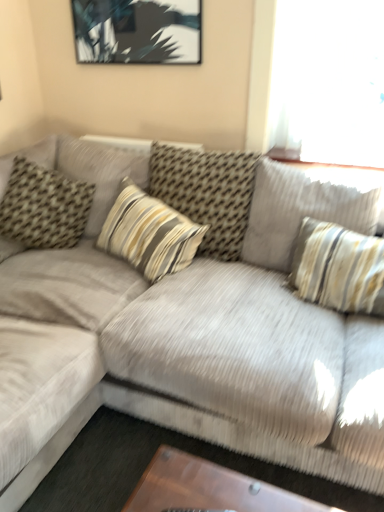
Locate an element on the screen. striped fabric pillow at center, which ranks as the second pillow in left-to-right order is located at coordinates (149, 233).

Image resolution: width=384 pixels, height=512 pixels. In order to click on velvet beige couch at center in this screenshot , I will do `click(188, 337)`.

The image size is (384, 512). In order to click on striped fabric pillow at center, acting as the 3th pillow starting from the right in this screenshot , I will do `click(149, 233)`.

Is there a large distance between striped fabric pillow at center, which ranks as the second pillow in left-to-right order, and velvet beige couch at center?

Actually, striped fabric pillow at center, which ranks as the second pillow in left-to-right order, and velvet beige couch at center are a little close together.

From the image's perspective, is striped fabric pillow at center, acting as the 3th pillow starting from the right, above or below velvet beige couch at center?

Clearly, from the image's perspective, striped fabric pillow at center, acting as the 3th pillow starting from the right, is above velvet beige couch at center.

Looking at the image, does striped fabric pillow at center, which ranks as the second pillow in left-to-right order, seem bigger or smaller compared to velvet beige couch at center?

In the image, striped fabric pillow at center, which ranks as the second pillow in left-to-right order, appears to be smaller than velvet beige couch at center.

Which point is more distant from viewer, (x=105, y=234) or (x=254, y=283)?

The point (x=105, y=234) is behind.

Which of these two, striped fabric pillow at upper right, the first pillow in the right-to-left sequence, or striped fabric pillow at center, which ranks as the second pillow in left-to-right order, is thinner?

striped fabric pillow at upper right, the first pillow in the right-to-left sequence, is thinner.

Which of these two, striped fabric pillow at upper right, the fourth pillow from the left, or striped fabric pillow at center, which ranks as the second pillow in left-to-right order, is bigger?

With larger size is striped fabric pillow at upper right, the fourth pillow from the left.

Can you see striped fabric pillow at upper right, the fourth pillow from the left, touching striped fabric pillow at center, acting as the 3th pillow starting from the right?

No, striped fabric pillow at upper right, the fourth pillow from the left, is not next to striped fabric pillow at center, acting as the 3th pillow starting from the right.

From the image's perspective, between velvet beige couch at center and striped fabric pillow at center, acting as the 3th pillow starting from the right, who is located below?

velvet beige couch at center is shown below in the image.

How many degrees apart are the facing directions of velvet beige couch at center and striped fabric pillow at center, which ranks as the second pillow in left-to-right order?

The angular difference between velvet beige couch at center and striped fabric pillow at center, which ranks as the second pillow in left-to-right order, is 16 degrees.

Can we say velvet beige couch at center lies outside striped fabric pillow at center, acting as the 3th pillow starting from the right?

Yes, velvet beige couch at center is located beyond the bounds of striped fabric pillow at center, acting as the 3th pillow starting from the right.

Would you say velvet beige couch at center is a long distance from striped fabric pillow at center, which ranks as the second pillow in left-to-right order?

velvet beige couch at center is near striped fabric pillow at center, which ranks as the second pillow in left-to-right order, not far away.

Which object is positioned more to the left, striped fabric pillow at center, the second pillow in the right-to-left sequence, or brown textured pillow at left, positioned as the fourth pillow in right-to-left order?

Positioned to the left is brown textured pillow at left, positioned as the fourth pillow in right-to-left order.

From the image's perspective, is striped fabric pillow at center, which is the third pillow in left-to-right order, under brown textured pillow at left, positioned as the fourth pillow in right-to-left order?

No.

From a real-world perspective, count 2nd pillows downward from the striped fabric pillow at center, which is the third pillow in left-to-right order, and point to it. Please provide its 2D coordinates.

[(44, 207)]

Does striped fabric pillow at center, the second pillow in the right-to-left sequence, turn towards brown textured pillow at left, positioned as the fourth pillow in right-to-left order?

No, striped fabric pillow at center, the second pillow in the right-to-left sequence, does not turn towards brown textured pillow at left, positioned as the fourth pillow in right-to-left order.

I want to click on pillow that is the 2nd object above the velvet beige couch at center (from a real-world perspective), so click(x=44, y=207).

Between point (76, 232) and point (53, 422), which one is positioned in front?

The point (53, 422) is closer.

From the image's perspective, which one is positioned higher, brown textured pillow at left, positioned as the fourth pillow in right-to-left order, or velvet beige couch at center?

From the image's view, brown textured pillow at left, positioned as the fourth pillow in right-to-left order, is above.

Between brown textured pillow at left, the 1th pillow from the left, and striped fabric pillow at upper right, the fourth pillow from the left, which one has smaller width?

Thinner between the two is brown textured pillow at left, the 1th pillow from the left.

You are a GUI agent. You are given a task and a screenshot of the screen. Output one action in this format:
    pyautogui.click(x=<x>, y=<y>)
    Task: Click on the 1st pillow located beneath the striped fabric pillow at upper right, the first pillow in the right-to-left sequence (from a real-world perspective)
    
    Given the screenshot: What is the action you would take?
    pyautogui.click(x=44, y=207)

Looking at this image, from a real-world perspective, is brown textured pillow at left, positioned as the fourth pillow in right-to-left order, under striped fabric pillow at upper right, the first pillow in the right-to-left sequence?

Yes, from a real-world perspective, brown textured pillow at left, positioned as the fourth pillow in right-to-left order, is beneath striped fabric pillow at upper right, the first pillow in the right-to-left sequence.

From the image's perspective, between brown textured pillow at left, positioned as the fourth pillow in right-to-left order, and striped fabric pillow at upper right, the first pillow in the right-to-left sequence, who is located below?

striped fabric pillow at upper right, the first pillow in the right-to-left sequence, is shown below in the image.

Who is taller, velvet beige couch at center or striped fabric pillow at upper right, the first pillow in the right-to-left sequence?

velvet beige couch at center is taller.

Considering the positions of point (304, 464) and point (244, 236), is point (304, 464) closer or farther from the camera than point (244, 236)?

Point (304, 464).

Is velvet beige couch at center to the right of striped fabric pillow at upper right, the fourth pillow from the left, from the viewer's perspective?

No, velvet beige couch at center is not to the right of striped fabric pillow at upper right, the fourth pillow from the left.

In terms of width, does velvet beige couch at center look wider or thinner when compared to striped fabric pillow at upper right, the fourth pillow from the left?

Considering their sizes, velvet beige couch at center looks broader than striped fabric pillow at upper right, the fourth pillow from the left.

Where is `studio couch on the left of striped fabric pillow at center, which ranks as the second pillow in left-to-right order`? The width and height of the screenshot is (384, 512). studio couch on the left of striped fabric pillow at center, which ranks as the second pillow in left-to-right order is located at coordinates (188, 337).

I want to click on pillow lying in front of the striped fabric pillow at center, acting as the 3th pillow starting from the right, so click(300, 210).

From the image, which object appears to be nearer to striped fabric pillow at center, acting as the 3th pillow starting from the right, striped fabric pillow at center, which is the third pillow in left-to-right order, or velvet beige couch at center?

striped fabric pillow at center, which is the third pillow in left-to-right order.

Looking at the image, which one is located closer to striped fabric pillow at center, which ranks as the second pillow in left-to-right order, velvet beige couch at center or brown textured pillow at left, the 1th pillow from the left?

Among the two, velvet beige couch at center is located nearer to striped fabric pillow at center, which ranks as the second pillow in left-to-right order.

From the image, which object appears to be nearer to striped fabric pillow at center, which is the third pillow in left-to-right order, striped fabric pillow at center, which ranks as the second pillow in left-to-right order, or velvet beige couch at center?

striped fabric pillow at center, which ranks as the second pillow in left-to-right order, lies closer to striped fabric pillow at center, which is the third pillow in left-to-right order, than the other object.

From the image, which object appears to be farther from striped fabric pillow at center, acting as the 3th pillow starting from the right, velvet beige couch at center or striped fabric pillow at upper right, the fourth pillow from the left?

Among the two, striped fabric pillow at upper right, the fourth pillow from the left, is located further to striped fabric pillow at center, acting as the 3th pillow starting from the right.

Estimate the real-world distances between objects in this image. Which object is closer to striped fabric pillow at center, the second pillow in the right-to-left sequence, velvet beige couch at center or striped fabric pillow at upper right, the fourth pillow from the left?

The object closer to striped fabric pillow at center, the second pillow in the right-to-left sequence, is striped fabric pillow at upper right, the fourth pillow from the left.

Looking at the image, which one is located closer to striped fabric pillow at center, which is the third pillow in left-to-right order, striped fabric pillow at upper right, the fourth pillow from the left, or striped fabric pillow at center, acting as the 3th pillow starting from the right?

striped fabric pillow at center, acting as the 3th pillow starting from the right.

Which object lies nearer to the anchor point striped fabric pillow at upper right, the first pillow in the right-to-left sequence, brown textured pillow at left, the 1th pillow from the left, or velvet beige couch at center?

Based on the image, velvet beige couch at center appears to be nearer to striped fabric pillow at upper right, the first pillow in the right-to-left sequence.

From the image, which object appears to be nearer to striped fabric pillow at center, which is the third pillow in left-to-right order, striped fabric pillow at center, acting as the 3th pillow starting from the right, or brown textured pillow at left, positioned as the fourth pillow in right-to-left order?

striped fabric pillow at center, acting as the 3th pillow starting from the right, lies closer to striped fabric pillow at center, which is the third pillow in left-to-right order, than the other object.

Locate an element on the screen. This screenshot has width=384, height=512. pillow between brown textured pillow at left, positioned as the fourth pillow in right-to-left order, and striped fabric pillow at center, the second pillow in the right-to-left sequence is located at coordinates (149, 233).

Where is `pillow positioned between velvet beige couch at center and striped fabric pillow at center, acting as the 3th pillow starting from the right, from near to far`? The height and width of the screenshot is (512, 384). pillow positioned between velvet beige couch at center and striped fabric pillow at center, acting as the 3th pillow starting from the right, from near to far is located at coordinates (300, 210).

The image size is (384, 512). Identify the location of pillow between striped fabric pillow at center, acting as the 3th pillow starting from the right, and striped fabric pillow at upper right, the fourth pillow from the left. (207, 193).